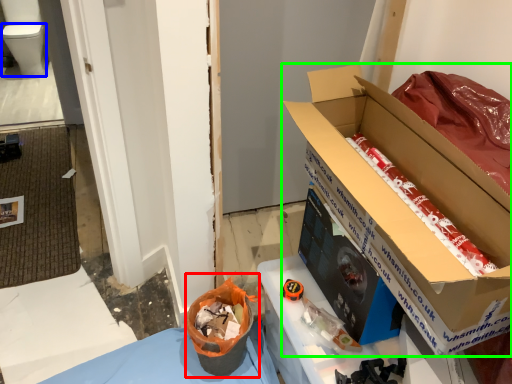
Question: Based on their relative distances, which object is nearer to recycling bin (highlighted by a red box)? Choose from toilet bowl (highlighted by a blue box) and box (highlighted by a green box).

Choices:
 (A) toilet bowl
 (B) box

Answer: (B)